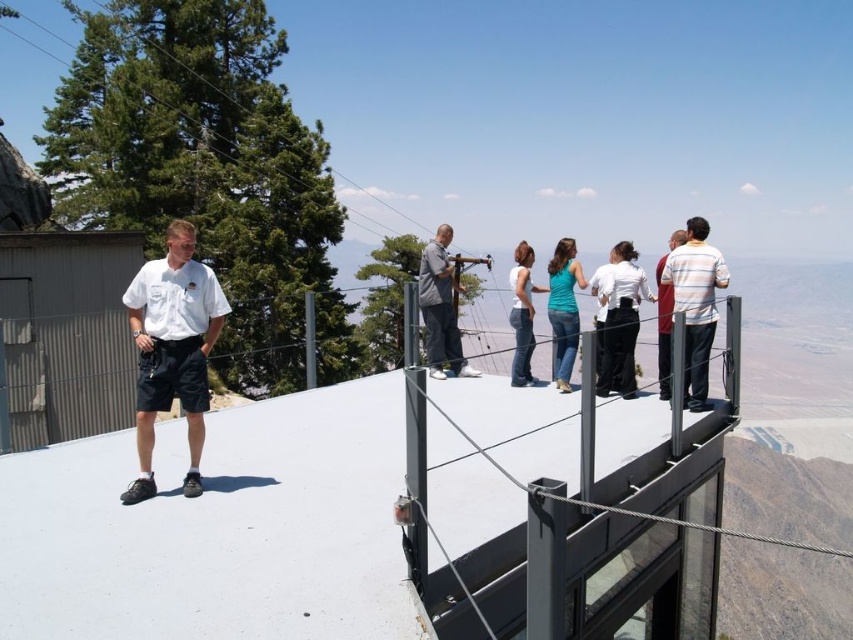
Between point (608, 376) and point (685, 240), which one is positioned behind?

Positioned behind is point (608, 376).

Who is positioned more to the right, white matte shirt at center or striped shirt at center?

From the viewer's perspective, striped shirt at center appears more on the right side.

Is point (637, 316) farther from viewer compared to point (662, 291)?

No.

Identify the location of white matte shirt at center. (621, 321).

Between striped cotton shirt at right and matte teal shirt at center, which one appears on the right side from the viewer's perspective?

From the viewer's perspective, striped cotton shirt at right appears more on the right side.

Where is `striped cotton shirt at right`? This screenshot has height=640, width=853. striped cotton shirt at right is located at coordinates (695, 305).

Locate an element on the screen. This screenshot has height=640, width=853. striped cotton shirt at right is located at coordinates (695, 305).

Is point (552, 376) in front of point (662, 330)?

No, it is not.

Which is below, matte teal shirt at center or striped shirt at center?

striped shirt at center is lower down.

Between point (560, 300) and point (660, 330), which one is positioned in front?

Point (660, 330)

This screenshot has height=640, width=853. I want to click on matte teal shirt at center, so click(563, 308).